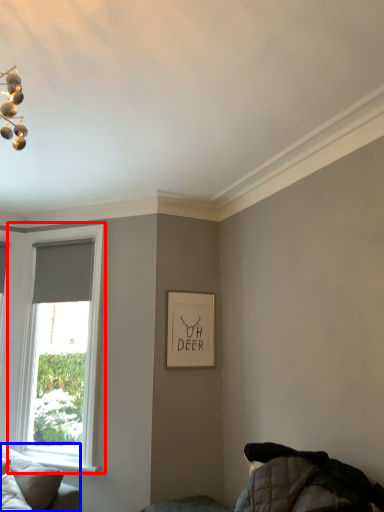
Question: Among these objects, which one is farthest to the camera, window (highlighted by a red box) or studio couch (highlighted by a blue box)?

Choices:
 (A) window
 (B) studio couch

Answer: (A)